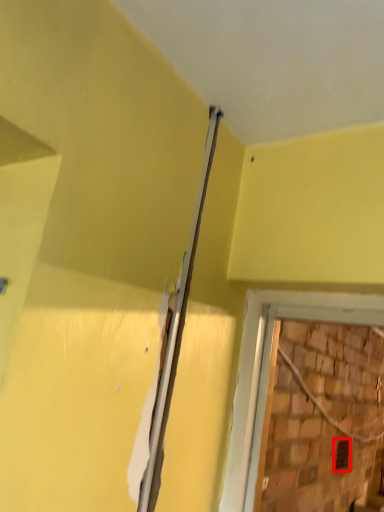
Question: From the image's perspective, where is hole (annotated by the red box) located relative to beam?

Choices:
 (A) below
 (B) above

Answer: (A)